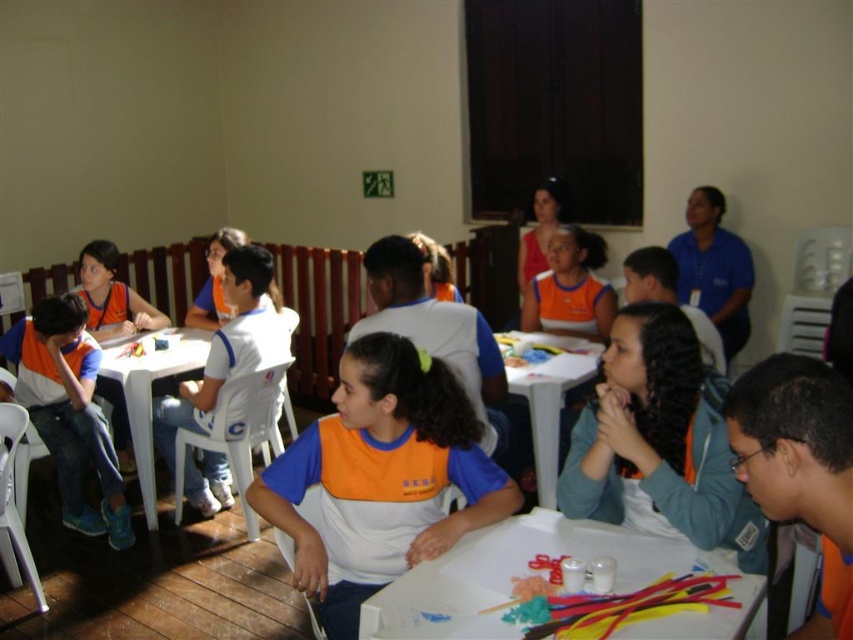
Between matte orange shirt at left and white plastic table at lower left, which one is positioned higher?

Positioned higher is white plastic table at lower left.

This screenshot has height=640, width=853. Find the location of `matte orange shirt at left`. matte orange shirt at left is located at coordinates (68, 412).

Is point (555, 522) positioned after point (508, 390)?

No, (555, 522) is in front of (508, 390).

Is point (636, 544) less distant than point (560, 339)?

That is True.

At what (x,y) coordinates should I click in order to perform the action: click on white plastic table at lower center. Please return your answer as a coordinate pair (x, y). Looking at the image, I should click on (546, 577).

Is white matte shirt at center to the left of orange fabric vest at center from the viewer's perspective?

Yes, white matte shirt at center is to the left of orange fabric vest at center.

How far apart are white matte shirt at center and orange fabric vest at center?

white matte shirt at center and orange fabric vest at center are 1.44 meters apart.

This screenshot has height=640, width=853. Describe the element at coordinates (228, 348) in the screenshot. I see `white matte shirt at center` at that location.

This screenshot has height=640, width=853. What are the coordinates of `white matte shirt at center` in the screenshot? It's located at (228, 348).